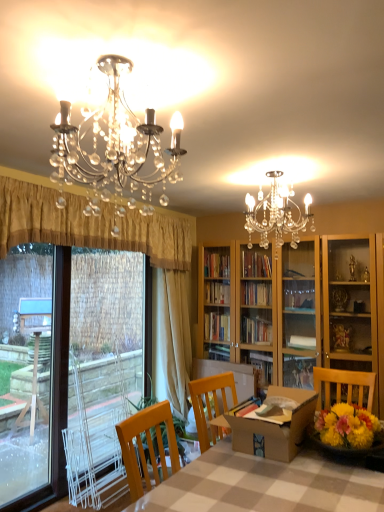
Question: Does gold pleated curtain at left, the second curtain positioned from the back, have a larger size compared to brown cardboard box at center?

Choices:
 (A) yes
 (B) no

Answer: (A)

Question: Is gold pleated curtain at left, placed as the 1th curtain when sorted from front to back, looking in the opposite direction of brown cardboard box at center?

Choices:
 (A) yes
 (B) no

Answer: (B)

Question: Is gold pleated curtain at left, the second curtain positioned from the back, further to camera compared to brown cardboard box at center?

Choices:
 (A) no
 (B) yes

Answer: (B)

Question: Does gold pleated curtain at left, placed as the 1th curtain when sorted from front to back, have a lesser height compared to brown cardboard box at center?

Choices:
 (A) no
 (B) yes

Answer: (A)

Question: Does gold pleated curtain at left, placed as the 1th curtain when sorted from front to back, have a smaller size compared to brown cardboard box at center?

Choices:
 (A) no
 (B) yes

Answer: (A)

Question: From the image's perspective, is gold pleated curtain at left, placed as the 1th curtain when sorted from front to back, beneath brown cardboard box at center?

Choices:
 (A) yes
 (B) no

Answer: (B)

Question: Considering the relative sizes of clear plastic screen door at left and checkered fabric table at center in the image provided, is clear plastic screen door at left bigger than checkered fabric table at center?

Choices:
 (A) no
 (B) yes

Answer: (A)

Question: Considering the relative sizes of clear plastic screen door at left and checkered fabric table at center in the image provided, is clear plastic screen door at left thinner than checkered fabric table at center?

Choices:
 (A) no
 (B) yes

Answer: (B)

Question: From a real-world perspective, does clear plastic screen door at left sit lower than checkered fabric table at center?

Choices:
 (A) yes
 (B) no

Answer: (B)

Question: From a real-world perspective, does clear plastic screen door at left stand above checkered fabric table at center?

Choices:
 (A) yes
 (B) no

Answer: (A)

Question: From the image's perspective, would you say clear plastic screen door at left is shown under checkered fabric table at center?

Choices:
 (A) no
 (B) yes

Answer: (A)

Question: Is clear plastic screen door at left located outside checkered fabric table at center?

Choices:
 (A) yes
 (B) no

Answer: (A)

Question: Considering the relative sizes of gold pleated curtain at left, placed as the 1th curtain when sorted from front to back, and checkered fabric table at center in the image provided, is gold pleated curtain at left, placed as the 1th curtain when sorted from front to back, smaller than checkered fabric table at center?

Choices:
 (A) no
 (B) yes

Answer: (B)